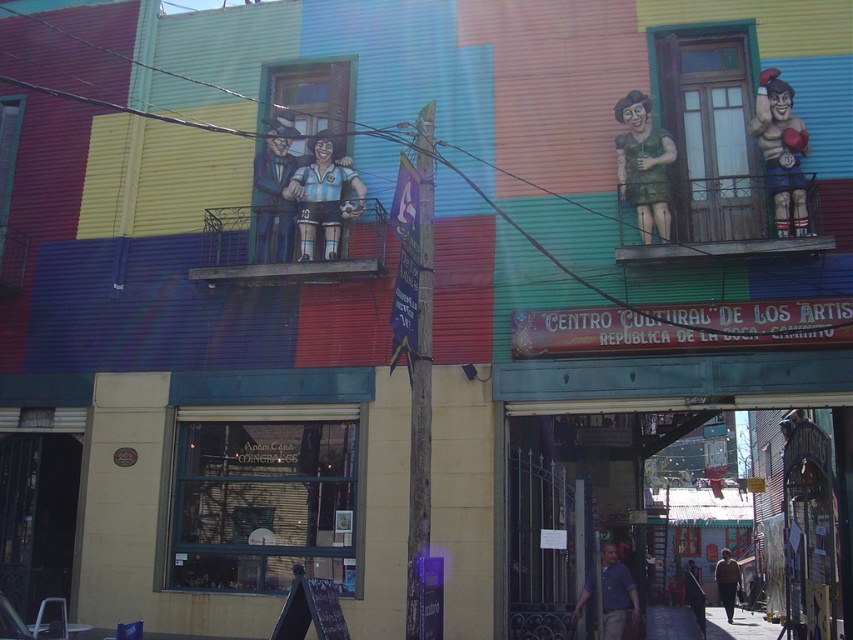
Can you confirm if blue shirt at center is thinner than dark brown leather jacket at lower right?

Indeed, blue shirt at center has a lesser width compared to dark brown leather jacket at lower right.

You are a GUI agent. You are given a task and a screenshot of the screen. Output one action in this format:
    pyautogui.click(x=<x>, y=<y>)
    Task: Click on the blue shirt at center
    
    Given the screenshot: What is the action you would take?
    pyautogui.click(x=616, y=593)

Who is more forward, (581,596) or (732,560)?

Point (581,596)

Identify the location of blue shirt at center. (616, 593).

Which is in front, point (311, 224) or point (701, 616)?

Point (311, 224) is more forward.

Which is more to the right, matte black soccer player at center or dark blue suit at lower right?

Positioned to the right is dark blue suit at lower right.

You are a GUI agent. You are given a task and a screenshot of the screen. Output one action in this format:
    pyautogui.click(x=<x>, y=<y>)
    Task: Click on the matte black soccer player at center
    The width and height of the screenshot is (853, 640).
    Given the screenshot: What is the action you would take?
    pyautogui.click(x=322, y=195)

Between point (798, 173) and point (627, 99), which one is positioned behind?

The point (627, 99) is more distant.

Does metallic green balcony at upper right appear on the right side of green matte statue at upper right?

Yes, metallic green balcony at upper right is to the right of green matte statue at upper right.

Who is more forward, (x=698, y=241) or (x=625, y=109)?

Point (x=698, y=241) is in front.

Identify the location of metallic green balcony at upper right. This screenshot has width=853, height=640. click(741, 220).